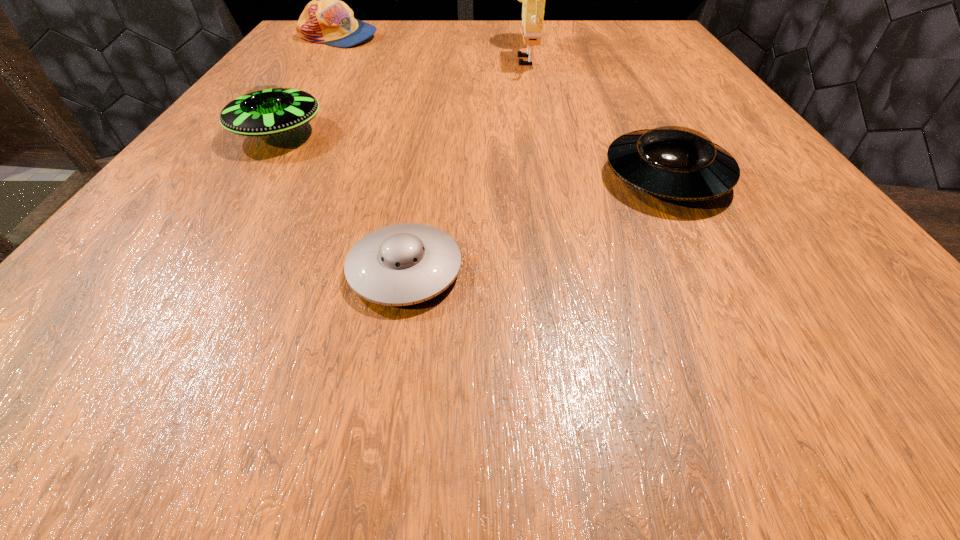
Locate an element on the screen. unoccupied area between the second object from right to left and the rightmost saucer is located at coordinates (597, 116).

Where is `free point between the third object from right to left and the second shortest object`? The height and width of the screenshot is (540, 960). free point between the third object from right to left and the second shortest object is located at coordinates (536, 223).

Find the location of a particular element. The image size is (960, 540). free space that is in between the fourth tallest object and the leftmost saucer is located at coordinates (472, 155).

Locate an element on the screen. This screenshot has height=540, width=960. vacant area between the tallest saucer and the sponge is located at coordinates click(x=402, y=93).

You are a GUI agent. You are given a task and a screenshot of the screen. Output one action in this format:
    pyautogui.click(x=<x>, y=<y>)
    Task: Click on the vacant space that's between the cap and the third object from left to right
    Image resolution: width=960 pixels, height=540 pixels.
    Given the screenshot: What is the action you would take?
    pyautogui.click(x=372, y=153)

Locate an element on the screen. object identified as the fourth closest to the tallest saucer is located at coordinates (673, 162).

Identify which object is the third closest to the fourth tallest object. Please provide its 2D coordinates. Your answer should be formatted as a tuple, i.e. [(x, y)], where the tuple contains the x and y coordinates of a point satisfying the conditions above.

[(265, 110)]

You are a GUI agent. You are given a task and a screenshot of the screen. Output one action in this format:
    pyautogui.click(x=<x>, y=<y>)
    Task: Click on the saucer that stands as the closest to the tallest saucer
    The image size is (960, 540).
    Given the screenshot: What is the action you would take?
    pyautogui.click(x=403, y=264)

The height and width of the screenshot is (540, 960). What are the coordinates of `saucer identified as the closest to the rightmost saucer` in the screenshot? It's located at (403, 264).

Where is `free space that satisfies the following two spatial constraints: 1. on the front-facing side of the sponge; 2. on the right side of the fourth tallest object`? Image resolution: width=960 pixels, height=540 pixels. free space that satisfies the following two spatial constraints: 1. on the front-facing side of the sponge; 2. on the right side of the fourth tallest object is located at coordinates (552, 177).